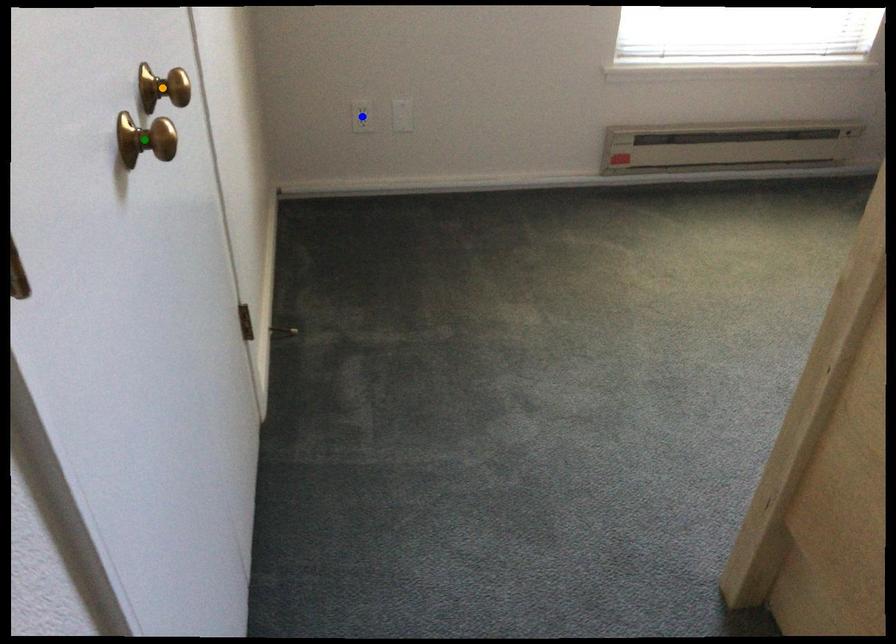
In the scene shown: Order these from nearest to farthest:
- green point
- blue point
- orange point

green point, orange point, blue point